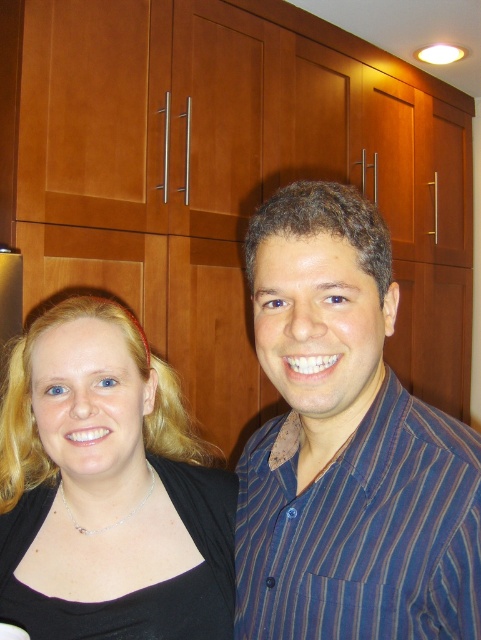
You are trying to decide which item to grab first in the kitchen scene. The matte black shirt at center and the black fabric at center are both in your line of sight. Which one is taller?

The matte black shirt at center is much taller than the black fabric at center.